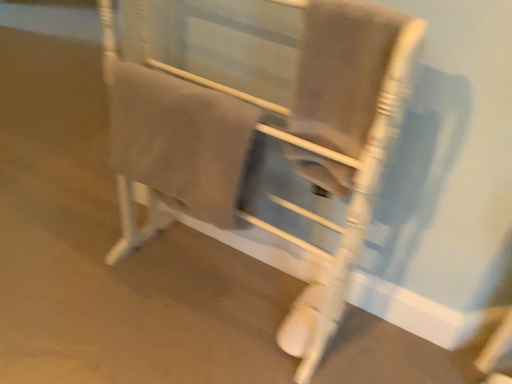
What do you see at coordinates (185, 143) in the screenshot?
I see `beige cotton towel at center` at bounding box center [185, 143].

Locate an element on the screen. The width and height of the screenshot is (512, 384). beige cotton towel at center is located at coordinates (185, 143).

What is the approximate width of matte white chair at center?

matte white chair at center is 12.16 inches wide.

The image size is (512, 384). What do you see at coordinates (261, 134) in the screenshot?
I see `matte white chair at center` at bounding box center [261, 134].

Where is `matte white chair at center`? matte white chair at center is located at coordinates (261, 134).

Identify the location of beige cotton towel at center. This screenshot has width=512, height=384. (185, 143).

Would you say matte white chair at center is to the left or to the right of beige cotton towel at center in the picture?

From the image, it's evident that matte white chair at center is to the right of beige cotton towel at center.

Is matte white chair at center in front of or behind beige cotton towel at center in the image?

In the image, matte white chair at center appears in front of beige cotton towel at center.

Is point (326, 299) closer to viewer compared to point (205, 200)?

No.

From the image's perspective, is matte white chair at center located above or below beige cotton towel at center?

Clearly, from the image's perspective, matte white chair at center is below beige cotton towel at center.

From a real-world perspective, is matte white chair at center positioned under beige cotton towel at center based on gravity?

Indeed, from a real-world perspective, matte white chair at center is positioned beneath beige cotton towel at center.

Can you confirm if matte white chair at center is thinner than beige cotton towel at center?

No, matte white chair at center is not thinner than beige cotton towel at center.

Who is taller, matte white chair at center or beige cotton towel at center?

matte white chair at center.

Does matte white chair at center have a smaller size compared to beige cotton towel at center?

No, matte white chair at center is not smaller than beige cotton towel at center.

Is beige cotton towel at center a part of matte white chair at center?

Yes, beige cotton towel at center can be found within matte white chair at center.

Would you consider matte white chair at center to be distant from beige cotton towel at center?

No, matte white chair at center is not far away from beige cotton towel at center.

Is matte white chair at center oriented away from beige cotton towel at center?

Correct, matte white chair at center is looking away from beige cotton towel at center.

Can you tell me how much matte white chair at center and beige cotton towel at center differ in facing direction?

They differ by 0.811 degrees in their facing directions.

In the image, there is a beige cotton towel at center. Where is `furniture below it (from the image's perspective)`? furniture below it (from the image's perspective) is located at coordinates (261, 134).

Which is more to the left, beige cotton towel at center or matte white chair at center?

Positioned to the left is beige cotton towel at center.

Considering the positions of objects beige cotton towel at center and matte white chair at center in the image provided, who is behind, beige cotton towel at center or matte white chair at center?

beige cotton towel at center is behind.

Which is behind, point (262, 157) or point (251, 197)?

The point (251, 197) is farther.

From the image's perspective, is beige cotton towel at center over matte white chair at center?

Yes, from the image's perspective, beige cotton towel at center is above matte white chair at center.

From a real-world perspective, is beige cotton towel at center under matte white chair at center?

No.

Does beige cotton towel at center have a lesser width compared to matte white chair at center?

Yes, beige cotton towel at center is thinner than matte white chair at center.

Between beige cotton towel at center and matte white chair at center, which one has more height?

matte white chair at center.

Is beige cotton towel at center bigger than matte white chair at center?

A: No.

Does beige cotton towel at center contain matte white chair at center?

No.

Is there a large distance between beige cotton towel at center and matte white chair at center?

No, beige cotton towel at center is not far from matte white chair at center.

Is beige cotton towel at center aimed at matte white chair at center?

Yes, beige cotton towel at center is oriented towards matte white chair at center.

What's the angular difference between beige cotton towel at center and matte white chair at center's facing directions?

0.811 degrees.

How far apart are beige cotton towel at center and matte white chair at center?

beige cotton towel at center is 3.88 inches from matte white chair at center.

I want to click on furniture that is in front of the beige cotton towel at center, so click(261, 134).

This screenshot has width=512, height=384. Identify the location of furniture lying on the right of beige cotton towel at center. (261, 134).

Locate an element on the screen. bath towel on the left of matte white chair at center is located at coordinates (185, 143).